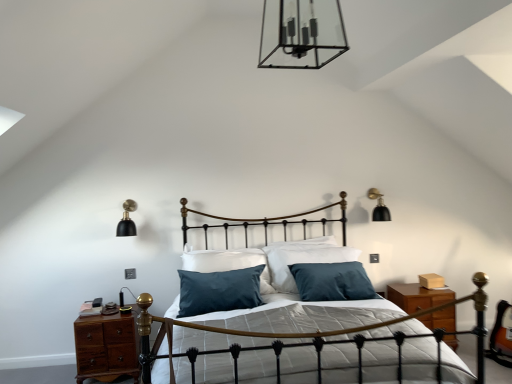
Question: Is black matte wall sconce at upper right, which is the third light fixture in left-to-right order, inside or outside of gold wrought iron bed frame at center?

Choices:
 (A) inside
 (B) outside

Answer: (B)

Question: In terms of height, does black matte wall sconce at upper right, placed as the 2th light fixture when sorted from top to bottom, look taller or shorter compared to gold wrought iron bed frame at center?

Choices:
 (A) tall
 (B) short

Answer: (B)

Question: Which of these objects is positioned closest to the brown wood nightstand at left?

Choices:
 (A) black matte wall sconce at upper right, which is counted as the second light fixture, starting from the bottom
 (B) black matte wall sconce at left, which ranks as the second light fixture in back-to-front order
 (C) teal fabric pillow at center
 (D) clear glass chandelier at upper center, which ranks as the third light fixture in back-to-front order
 (E) gold wrought iron bed frame at center

Answer: (B)

Question: Which object is positioned farthest from the black matte wall sconce at upper right, placed as the 2th light fixture when sorted from top to bottom?

Choices:
 (A) black matte wall sconce at left, the 3th light fixture when ordered from top to bottom
 (B) clear glass chandelier at upper center, arranged as the 3th light fixture when ordered from the bottom
 (C) teal fabric pillow at center
 (D) brown wood nightstand at left
 (E) gold wrought iron bed frame at center

Answer: (D)